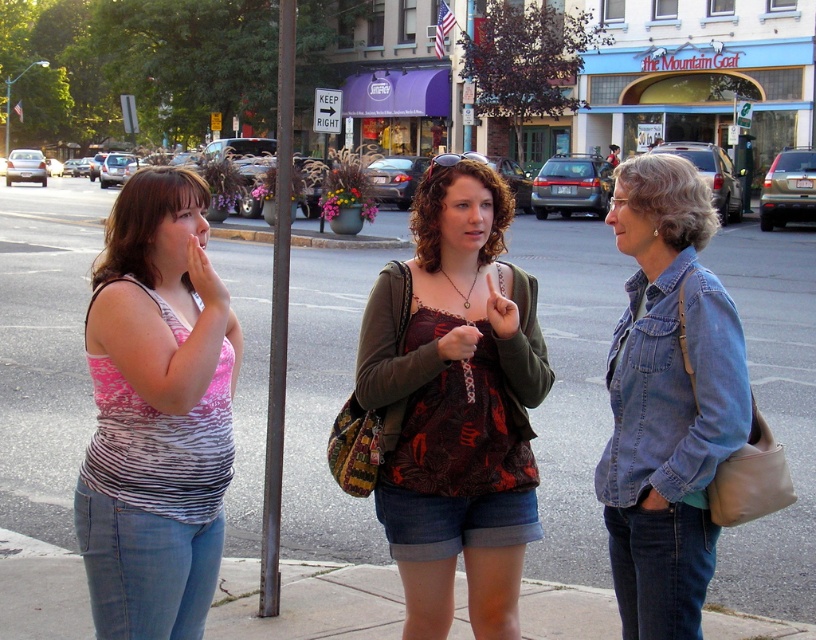
Does pink striped tank top at left have a greater width compared to denim jacket at lower right?

Yes, pink striped tank top at left is wider than denim jacket at lower right.

Can you confirm if pink striped tank top at left is positioned below denim jacket at lower right?

Correct, pink striped tank top at left is located below denim jacket at lower right.

Find the location of a particular element. The height and width of the screenshot is (640, 816). pink striped tank top at left is located at coordinates (156, 413).

Identify the location of pink striped tank top at left. (156, 413).

Who is more distant from viewer, (202, 592) or (264, 512)?

The point (264, 512) is more distant.

Is pink striped tank top at left taller than dark gray metal pole at center?

Incorrect, pink striped tank top at left's height is not larger of dark gray metal pole at center's.

Image resolution: width=816 pixels, height=640 pixels. In order to click on pink striped tank top at left in this screenshot , I will do `click(156, 413)`.

Does paved concrete sidewalk at center have a lesser height compared to pink striped tank top at left?

No.

Can you confirm if paved concrete sidewalk at center is positioned above pink striped tank top at left?

Indeed, paved concrete sidewalk at center is positioned over pink striped tank top at left.

Is point (229, 515) farther from camera compared to point (98, 616)?

Yes.

Identify the location of paved concrete sidewalk at center. (43, 349).